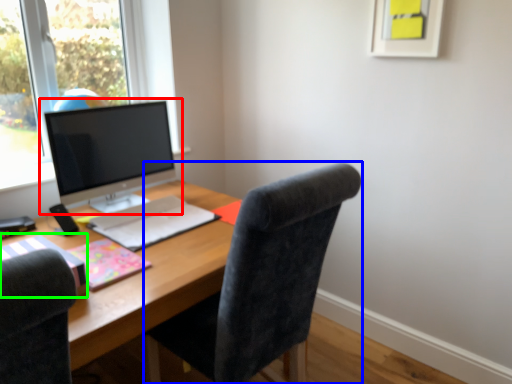
Question: Considering the real-world distances, which object is closest to computer monitor (highlighted by a red box)? chair (highlighted by a blue box) or notebook (highlighted by a green box).

Choices:
 (A) chair
 (B) notebook

Answer: (B)